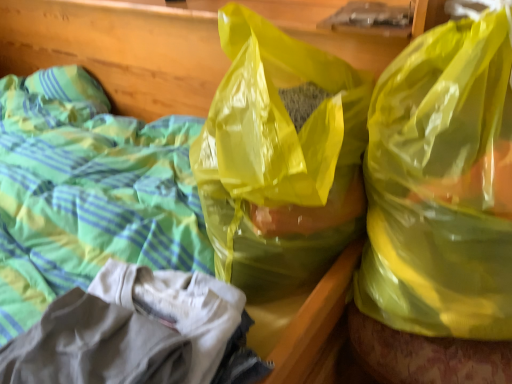
Where is `translucent yellow plastic bag at center, arranged as the 2th plastic bag when viewed from the right`? translucent yellow plastic bag at center, arranged as the 2th plastic bag when viewed from the right is located at coordinates (279, 159).

What do you see at coordinates (279, 159) in the screenshot?
I see `translucent yellow plastic bag at center, arranged as the 2th plastic bag when viewed from the right` at bounding box center [279, 159].

The width and height of the screenshot is (512, 384). What do you see at coordinates (442, 185) in the screenshot?
I see `yellow translucent plastic bag at upper right, placed as the 2th plastic bag when sorted from left to right` at bounding box center [442, 185].

Where is `yellow translucent plastic bag at upper right, which is the 1th plastic bag in right-to-left order`? The height and width of the screenshot is (384, 512). yellow translucent plastic bag at upper right, which is the 1th plastic bag in right-to-left order is located at coordinates (442, 185).

Locate an element on the screen. translucent yellow plastic bag at center, arranged as the 2th plastic bag when viewed from the right is located at coordinates (279, 159).

Is yellow translucent plastic bag at upper right, which is the 1th plastic bag in right-to-left order, at the left side of translucent yellow plastic bag at center, the first plastic bag from the left?

In fact, yellow translucent plastic bag at upper right, which is the 1th plastic bag in right-to-left order, is to the right of translucent yellow plastic bag at center, the first plastic bag from the left.

Considering their positions, is yellow translucent plastic bag at upper right, placed as the 2th plastic bag when sorted from left to right, located in front of or behind translucent yellow plastic bag at center, arranged as the 2th plastic bag when viewed from the right?

yellow translucent plastic bag at upper right, placed as the 2th plastic bag when sorted from left to right, is positioned closer to the viewer than translucent yellow plastic bag at center, arranged as the 2th plastic bag when viewed from the right.

Considering the points (409, 287) and (257, 192), which point is in front, point (409, 287) or point (257, 192)?

Point (257, 192)

From the image's perspective, which one is positioned lower, yellow translucent plastic bag at upper right, which is the 1th plastic bag in right-to-left order, or translucent yellow plastic bag at center, arranged as the 2th plastic bag when viewed from the right?

yellow translucent plastic bag at upper right, which is the 1th plastic bag in right-to-left order.

From a real-world perspective, which is physically above, yellow translucent plastic bag at upper right, which is the 1th plastic bag in right-to-left order, or translucent yellow plastic bag at center, arranged as the 2th plastic bag when viewed from the right?

yellow translucent plastic bag at upper right, which is the 1th plastic bag in right-to-left order.

Considering the sizes of objects yellow translucent plastic bag at upper right, placed as the 2th plastic bag when sorted from left to right, and translucent yellow plastic bag at center, the first plastic bag from the left, in the image provided, who is wider, yellow translucent plastic bag at upper right, placed as the 2th plastic bag when sorted from left to right, or translucent yellow plastic bag at center, the first plastic bag from the left,?

translucent yellow plastic bag at center, the first plastic bag from the left.

Considering the relative sizes of yellow translucent plastic bag at upper right, placed as the 2th plastic bag when sorted from left to right, and translucent yellow plastic bag at center, the first plastic bag from the left, in the image provided, is yellow translucent plastic bag at upper right, placed as the 2th plastic bag when sorted from left to right, shorter than translucent yellow plastic bag at center, the first plastic bag from the left,?

In fact, yellow translucent plastic bag at upper right, placed as the 2th plastic bag when sorted from left to right, may be taller than translucent yellow plastic bag at center, the first plastic bag from the left.

Considering the relative sizes of yellow translucent plastic bag at upper right, placed as the 2th plastic bag when sorted from left to right, and translucent yellow plastic bag at center, arranged as the 2th plastic bag when viewed from the right, in the image provided, is yellow translucent plastic bag at upper right, placed as the 2th plastic bag when sorted from left to right, smaller than translucent yellow plastic bag at center, arranged as the 2th plastic bag when viewed from the right,?

Indeed, yellow translucent plastic bag at upper right, placed as the 2th plastic bag when sorted from left to right, has a smaller size compared to translucent yellow plastic bag at center, arranged as the 2th plastic bag when viewed from the right.

Consider the image. Would you say yellow translucent plastic bag at upper right, placed as the 2th plastic bag when sorted from left to right, contains translucent yellow plastic bag at center, arranged as the 2th plastic bag when viewed from the right?

No.

Is yellow translucent plastic bag at upper right, which is the 1th plastic bag in right-to-left order, not close to translucent yellow plastic bag at center, the first plastic bag from the left?

They are positioned close to each other.

Is yellow translucent plastic bag at upper right, which is the 1th plastic bag in right-to-left order, oriented away from translucent yellow plastic bag at center, arranged as the 2th plastic bag when viewed from the right?

No, yellow translucent plastic bag at upper right, which is the 1th plastic bag in right-to-left order,'s orientation is not away from translucent yellow plastic bag at center, arranged as the 2th plastic bag when viewed from the right.

Find the location of `plastic bag below the yellow translucent plastic bag at upper right, placed as the 2th plastic bag when sorted from left to right (from a real-world perspective)`. plastic bag below the yellow translucent plastic bag at upper right, placed as the 2th plastic bag when sorted from left to right (from a real-world perspective) is located at coordinates (279, 159).

Which is more to the left, translucent yellow plastic bag at center, the first plastic bag from the left, or yellow translucent plastic bag at upper right, placed as the 2th plastic bag when sorted from left to right?

translucent yellow plastic bag at center, the first plastic bag from the left.

Between translucent yellow plastic bag at center, the first plastic bag from the left, and yellow translucent plastic bag at upper right, which is the 1th plastic bag in right-to-left order, which one is positioned behind?

translucent yellow plastic bag at center, the first plastic bag from the left, is more distant.

Which is farther, [248,119] or [492,84]?

The point [248,119] is behind.

From the image's perspective, between translucent yellow plastic bag at center, arranged as the 2th plastic bag when viewed from the right, and yellow translucent plastic bag at upper right, which is the 1th plastic bag in right-to-left order, who is located below?

From the image's view, yellow translucent plastic bag at upper right, which is the 1th plastic bag in right-to-left order, is below.

From a real-world perspective, is translucent yellow plastic bag at center, the first plastic bag from the left, positioned above or below yellow translucent plastic bag at upper right, which is the 1th plastic bag in right-to-left order?

translucent yellow plastic bag at center, the first plastic bag from the left, is below yellow translucent plastic bag at upper right, which is the 1th plastic bag in right-to-left order.

In terms of width, does translucent yellow plastic bag at center, arranged as the 2th plastic bag when viewed from the right, look wider or thinner when compared to yellow translucent plastic bag at upper right, which is the 1th plastic bag in right-to-left order?

Considering their sizes, translucent yellow plastic bag at center, arranged as the 2th plastic bag when viewed from the right, looks broader than yellow translucent plastic bag at upper right, which is the 1th plastic bag in right-to-left order.

Between translucent yellow plastic bag at center, arranged as the 2th plastic bag when viewed from the right, and yellow translucent plastic bag at upper right, placed as the 2th plastic bag when sorted from left to right, which one has less height?

Standing shorter between the two is translucent yellow plastic bag at center, arranged as the 2th plastic bag when viewed from the right.

Does translucent yellow plastic bag at center, arranged as the 2th plastic bag when viewed from the right, have a smaller size compared to yellow translucent plastic bag at upper right, placed as the 2th plastic bag when sorted from left to right?

No.

Which is correct: translucent yellow plastic bag at center, arranged as the 2th plastic bag when viewed from the right, is inside yellow translucent plastic bag at upper right, placed as the 2th plastic bag when sorted from left to right, or outside of it?

translucent yellow plastic bag at center, arranged as the 2th plastic bag when viewed from the right, is not enclosed by yellow translucent plastic bag at upper right, placed as the 2th plastic bag when sorted from left to right.

Can you see translucent yellow plastic bag at center, arranged as the 2th plastic bag when viewed from the right, touching yellow translucent plastic bag at upper right, which is the 1th plastic bag in right-to-left order?

There is a gap between translucent yellow plastic bag at center, arranged as the 2th plastic bag when viewed from the right, and yellow translucent plastic bag at upper right, which is the 1th plastic bag in right-to-left order.

Is translucent yellow plastic bag at center, the first plastic bag from the left, positioned with its back to yellow translucent plastic bag at upper right, which is the 1th plastic bag in right-to-left order?

Yes, yellow translucent plastic bag at upper right, which is the 1th plastic bag in right-to-left order, is at the back of translucent yellow plastic bag at center, the first plastic bag from the left.

How different are the orientations of translucent yellow plastic bag at center, arranged as the 2th plastic bag when viewed from the right, and yellow translucent plastic bag at upper right, which is the 1th plastic bag in right-to-left order, in degrees?

There is a 76.1-degree angle between the facing directions of translucent yellow plastic bag at center, arranged as the 2th plastic bag when viewed from the right, and yellow translucent plastic bag at upper right, which is the 1th plastic bag in right-to-left order.

Where is `plastic bag that is above the yellow translucent plastic bag at upper right, placed as the 2th plastic bag when sorted from left to right (from the image's perspective)`? The width and height of the screenshot is (512, 384). plastic bag that is above the yellow translucent plastic bag at upper right, placed as the 2th plastic bag when sorted from left to right (from the image's perspective) is located at coordinates (279, 159).

Locate an element on the screen. plastic bag lying below the translucent yellow plastic bag at center, the first plastic bag from the left (from the image's perspective) is located at coordinates (442, 185).

Identify the location of plastic bag that is behind the yellow translucent plastic bag at upper right, placed as the 2th plastic bag when sorted from left to right. (279, 159).